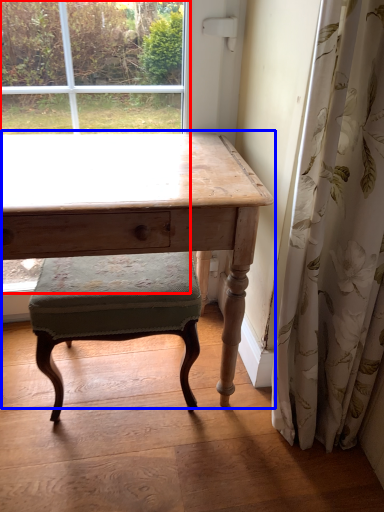
Question: Which object is closer to the camera taking this photo, bay window (highlighted by a red box) or table (highlighted by a blue box)?

Choices:
 (A) bay window
 (B) table

Answer: (B)